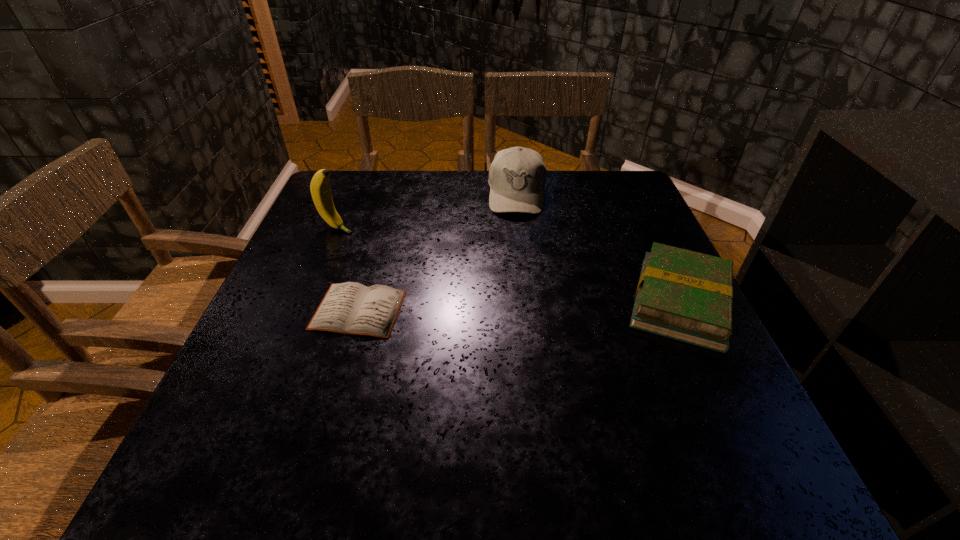
What are the coordinates of `blank area located 0.350m on the front-facing side of the third object from left to right` in the screenshot? It's located at tap(512, 316).

Where is `free space located 0.260m on the front-facing side of the third object from left to right`? This screenshot has height=540, width=960. free space located 0.260m on the front-facing side of the third object from left to right is located at coordinates (514, 286).

Where is `vacant space situated 0.130m from the stem of the second farthest object`? vacant space situated 0.130m from the stem of the second farthest object is located at coordinates (392, 247).

Locate an element on the screen. This screenshot has width=960, height=540. vacant space positioned from the stem of the second farthest object is located at coordinates pos(396,248).

At what (x,y) coordinates should I click in order to perform the action: click on vacant position located 0.290m from the stem of the second farthest object. Please return your answer as a coordinate pair (x, y). Looking at the image, I should click on (447, 268).

Find the location of a particular element. object that is at the far edge is located at coordinates (517, 176).

Find the location of a particular element. diary located at the left edge is located at coordinates (349, 308).

Locate an element on the screen. This screenshot has width=960, height=540. banana that is at the left edge is located at coordinates [x=320, y=190].

Locate an element on the screen. Image resolution: width=960 pixels, height=540 pixels. object that is at the right edge is located at coordinates (684, 295).

This screenshot has height=540, width=960. In the image, there is a desktop. In order to click on vacant space at the far edge in this screenshot , I will do `click(448, 188)`.